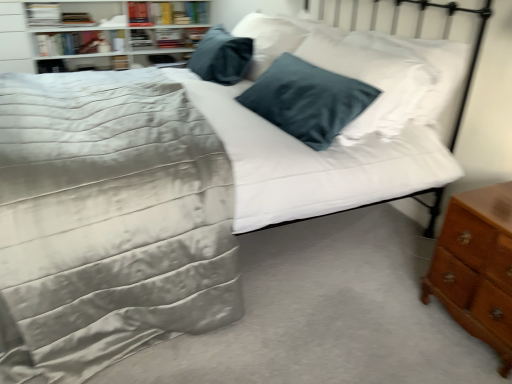
Question: Considering the positions of brown wooden nightstand at lower right and white glossy bookshelf at upper left in the image, is brown wooden nightstand at lower right taller or shorter than white glossy bookshelf at upper left?

Choices:
 (A) short
 (B) tall

Answer: (A)

Question: In terms of width, does brown wooden nightstand at lower right look wider or thinner when compared to white glossy bookshelf at upper left?

Choices:
 (A) thin
 (B) wide

Answer: (A)

Question: Estimate the real-world distances between objects in this image. Which object is farther from the brown wooden nightstand at lower right?

Choices:
 (A) satin gray comforter at center
 (B) hardcover book at upper left, the second book when ordered from left to right
 (C) hardcover book at upper left, which appears as the 2th book when viewed from the right
 (D) white glossy bookshelf at upper left
 (E) hardcover book at upper left, positioned as the 4th book in left-to-right order

Answer: (C)

Question: Based on their relative distances, which object is farther from the hardcover book at upper left, which is the third book from right to left?

Choices:
 (A) white glossy bookshelf at upper left
 (B) brown wooden nightstand at lower right
 (C) hardcover book at upper left, the 1th book when ordered from right to left
 (D) hardcover book at upper left, placed as the fourth book when sorted from right to left
 (E) satin gray comforter at center

Answer: (B)